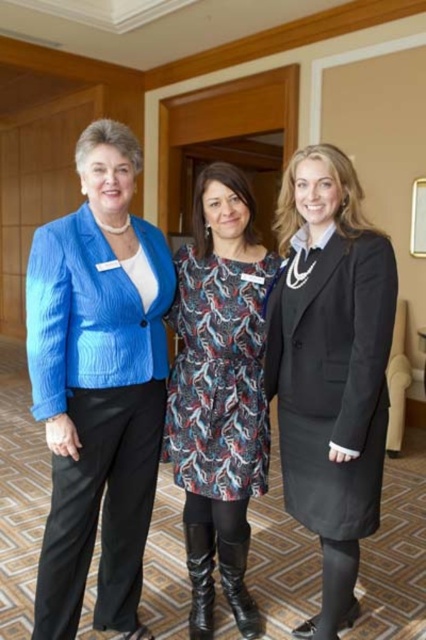
Question: Is matte black suit at center behind printed fabric dress at center?

Choices:
 (A) yes
 (B) no

Answer: (B)

Question: Which object is positioned farthest from the printed fabric dress at center?

Choices:
 (A) matte blue blazer at left
 (B) matte black suit at center

Answer: (A)

Question: Among these objects, which one is farthest from the camera?

Choices:
 (A) matte blue blazer at left
 (B) matte black suit at center

Answer: (A)

Question: Does matte blue blazer at left lie behind matte black suit at center?

Choices:
 (A) no
 (B) yes

Answer: (B)

Question: Based on their relative distances, which object is nearer to the matte black suit at center?

Choices:
 (A) matte blue blazer at left
 (B) printed fabric dress at center

Answer: (B)

Question: Can you confirm if matte blue blazer at left is thinner than matte black suit at center?

Choices:
 (A) no
 (B) yes

Answer: (A)